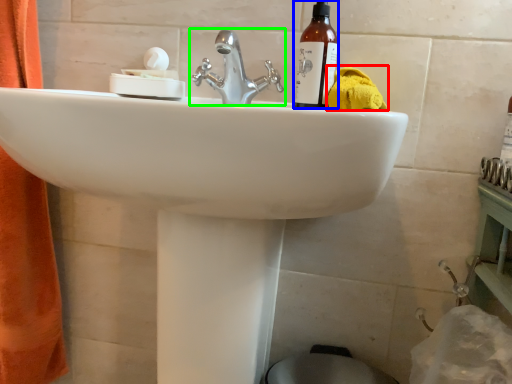
Question: Considering the real-world distances, which object is farthest from bath towel (highlighted by a red box)? bottle (highlighted by a blue box) or tap (highlighted by a green box)?

Choices:
 (A) bottle
 (B) tap

Answer: (B)